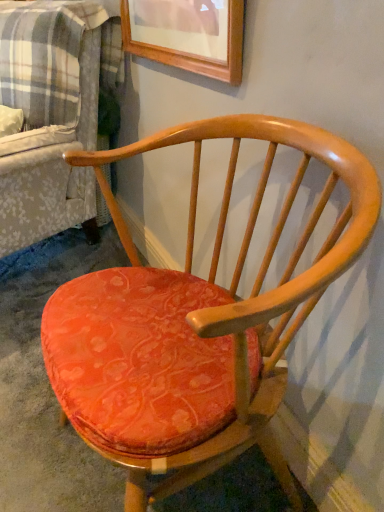
I want to click on velvet orange cushion at center, so click(138, 360).

What do you see at coordinates (196, 322) in the screenshot?
I see `matte orange cushioned chair at center` at bounding box center [196, 322].

Where is `velvet orange cushion at center`? velvet orange cushion at center is located at coordinates (138, 360).

From the image's perspective, who appears lower, plaid fabric couch at left or velvet orange cushion at center?

velvet orange cushion at center.

Choose the correct answer: Is plaid fabric couch at left inside velvet orange cushion at center or outside it?

plaid fabric couch at left is not enclosed by velvet orange cushion at center.

Which is behind, point (70, 211) or point (161, 296)?

The point (70, 211) is more distant.

Is velvet orange cushion at center shorter than matte orange cushioned chair at center?

Yes, velvet orange cushion at center is shorter than matte orange cushioned chair at center.

Is velvet orange cushion at center to the right of matte orange cushioned chair at center from the viewer's perspective?

In fact, velvet orange cushion at center is to the left of matte orange cushioned chair at center.

Considering the sizes of objects velvet orange cushion at center and matte orange cushioned chair at center in the image provided, who is thinner, velvet orange cushion at center or matte orange cushioned chair at center?

With smaller width is matte orange cushioned chair at center.

In the scene shown: Between velvet orange cushion at center and matte orange cushioned chair at center, which one has larger size?

Bigger between the two is matte orange cushioned chair at center.

Are matte orange cushioned chair at center and velvet orange cushion at center located far from each other?

matte orange cushioned chair at center is actually quite close to velvet orange cushion at center.

The height and width of the screenshot is (512, 384). Identify the location of chair in front of the velvet orange cushion at center. (196, 322).

Is velvet orange cushion at center at the back of matte orange cushioned chair at center?

No, matte orange cushioned chair at center is not facing away from velvet orange cushion at center.

Is matte orange cushioned chair at center outside of plaid fabric couch at left?

Yes, matte orange cushioned chair at center is not within plaid fabric couch at left.

Are matte orange cushioned chair at center and plaid fabric couch at left far apart?

matte orange cushioned chair at center is near plaid fabric couch at left, not far away.

From a real-world perspective, which is physically above, matte orange cushioned chair at center or plaid fabric couch at left?

plaid fabric couch at left.

Between matte orange cushioned chair at center and plaid fabric couch at left, which one has less height?

matte orange cushioned chair at center.

Between plaid fabric couch at left and matte orange cushioned chair at center, which one has smaller size?

Smaller between the two is matte orange cushioned chair at center.

Is plaid fabric couch at left oriented towards matte orange cushioned chair at center?

No, plaid fabric couch at left is not oriented towards matte orange cushioned chair at center.

From the image's perspective, between plaid fabric couch at left and matte orange cushioned chair at center, which one is located above?

From the image's view, plaid fabric couch at left is above.

From a real-world perspective, is plaid fabric couch at left above or below matte orange cushioned chair at center?

From a real-world perspective, plaid fabric couch at left is physically above matte orange cushioned chair at center.

In the image, is velvet orange cushion at center positioned in front of or behind plaid fabric couch at left?

velvet orange cushion at center is in front of plaid fabric couch at left.

Considering the relative positions of velvet orange cushion at center and plaid fabric couch at left in the image provided, is velvet orange cushion at center to the left or to the right of plaid fabric couch at left?

velvet orange cushion at center is positioned on plaid fabric couch at left's right side.

From the image's perspective, between velvet orange cushion at center and plaid fabric couch at left, which one is located above?

From the image's view, plaid fabric couch at left is above.

Where is `couch located on the left of velvet orange cushion at center`? This screenshot has width=384, height=512. couch located on the left of velvet orange cushion at center is located at coordinates (52, 132).

At what (x,y) coordinates should I click in order to perform the action: click on table below the matte orange cushioned chair at center (from the image's perspective). Please return your answer as a coordinate pair (x, y). This screenshot has height=512, width=384. Looking at the image, I should click on (138, 360).

When comparing their distances from plaid fabric couch at left, does matte orange cushioned chair at center or velvet orange cushion at center seem further?

Based on the image, velvet orange cushion at center appears to be further to plaid fabric couch at left.

Looking at this image, when comparing their distances from matte orange cushioned chair at center, does velvet orange cushion at center or plaid fabric couch at left seem further?

Among the two, plaid fabric couch at left is located further to matte orange cushioned chair at center.

From the picture: Considering their positions, is plaid fabric couch at left positioned closer to matte orange cushioned chair at center than velvet orange cushion at center?

The object closer to matte orange cushioned chair at center is velvet orange cushion at center.

Considering their positions, is matte orange cushioned chair at center positioned further to velvet orange cushion at center than plaid fabric couch at left?

plaid fabric couch at left is positioned further to the anchor velvet orange cushion at center.

From the image, which object appears to be farther from plaid fabric couch at left, velvet orange cushion at center or matte orange cushioned chair at center?

velvet orange cushion at center is further to plaid fabric couch at left.

Which object lies further to the anchor point velvet orange cushion at center, plaid fabric couch at left or matte orange cushioned chair at center?

plaid fabric couch at left lies further to velvet orange cushion at center than the other object.

You are a GUI agent. You are given a task and a screenshot of the screen. Output one action in this format:
    pyautogui.click(x=<x>, y=<y>)
    Task: Click on the chair that lies between plaid fabric couch at left and velvet orange cushion at center from top to bottom
    This screenshot has height=512, width=384.
    Given the screenshot: What is the action you would take?
    pyautogui.click(x=196, y=322)